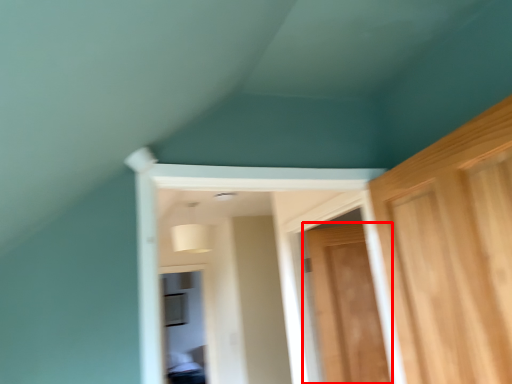
Question: Considering the relative positions of door (annotated by the red box) and window in the image provided, where is door (annotated by the red box) located with respect to the staircase?

Choices:
 (A) left
 (B) right

Answer: (B)